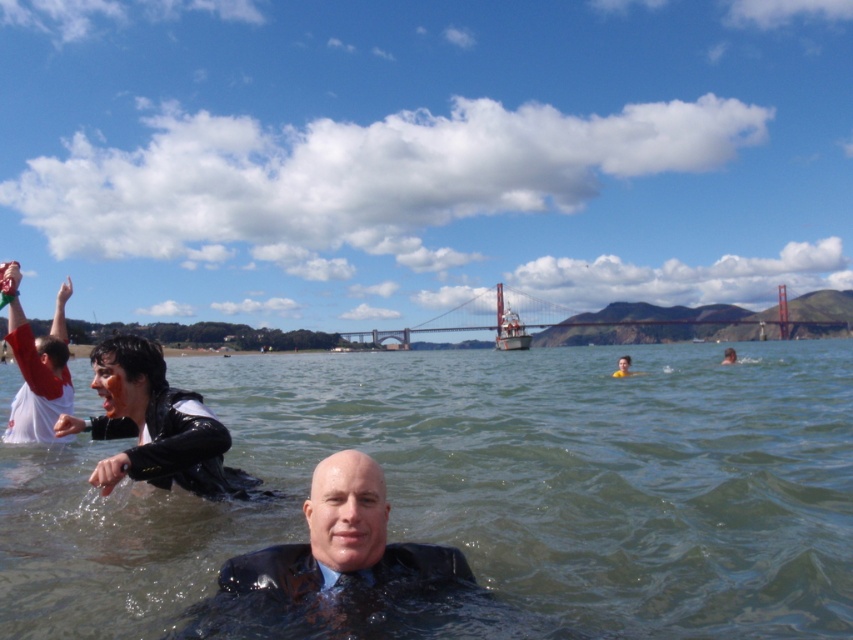
Question: Considering the real-world distances, which object is closest to the clear water at center?

Choices:
 (A) white matte shirt at upper left
 (B) smooth skin face at center

Answer: (B)

Question: Which point is farther to the camera?

Choices:
 (A) (57, 378)
 (B) (834, 445)
 (C) (136, 372)
 (D) (635, 372)

Answer: (D)

Question: Is white matte shirt at upper left smaller than smooth skin face at center?

Choices:
 (A) yes
 (B) no

Answer: (B)

Question: Is clear water at center below metallic bridge at center?

Choices:
 (A) yes
 (B) no

Answer: (A)

Question: Which point is closer to the camera?

Choices:
 (A) (293, 609)
 (B) (534, 326)
 (C) (625, 362)

Answer: (A)

Question: Is black matte wetsuit at left wider than smooth skin face at center?

Choices:
 (A) yes
 (B) no

Answer: (B)